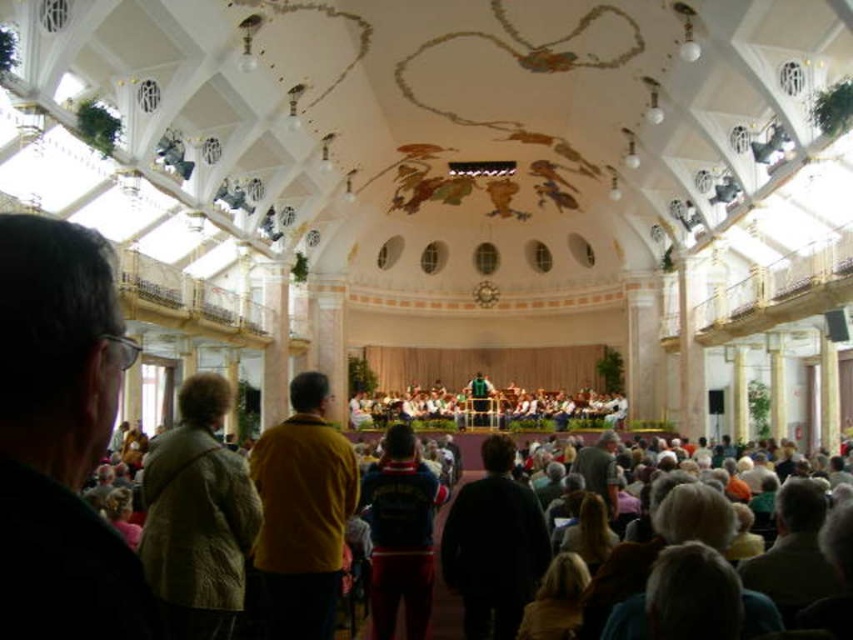
Question: Is light brown textured jacket at center bigger than mustard yellow sweater at center?

Choices:
 (A) no
 (B) yes

Answer: (B)

Question: Which of the following is the farthest from the observer?

Choices:
 (A) light brown textured jacket at center
 (B) mustard yellow sweater at center

Answer: (B)

Question: In this image, where is light brown textured jacket at center located relative to mustard yellow sweater at center?

Choices:
 (A) left
 (B) right

Answer: (A)

Question: Is light brown textured jacket at center to the left of mustard yellow sweater at center from the viewer's perspective?

Choices:
 (A) yes
 (B) no

Answer: (A)